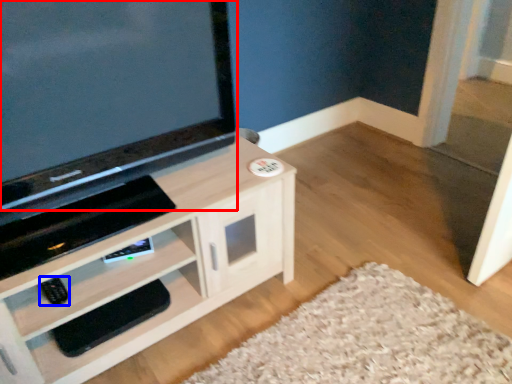
Question: Which of the following is the farthest to the observer, television (highlighted by a red box) or remote (highlighted by a blue box)?

Choices:
 (A) television
 (B) remote

Answer: (B)